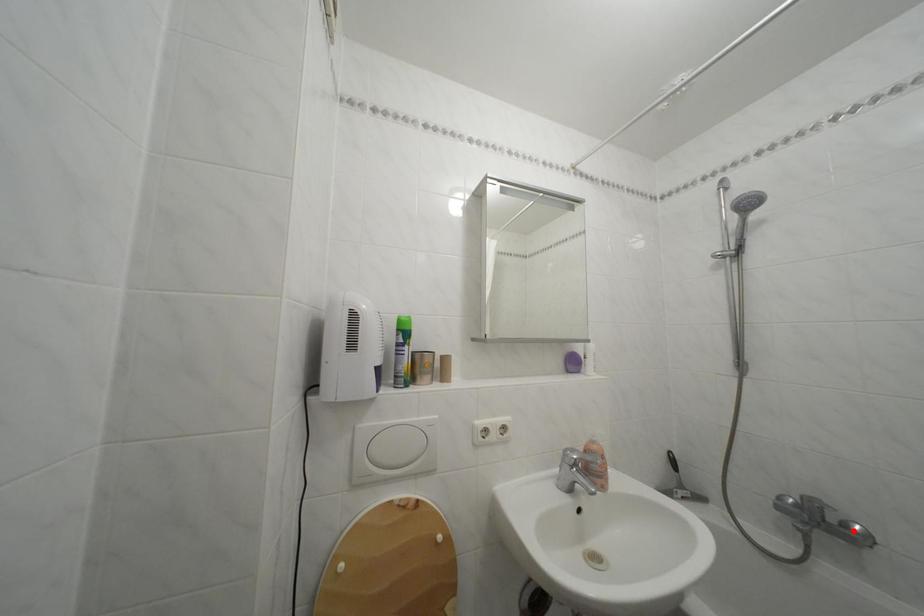
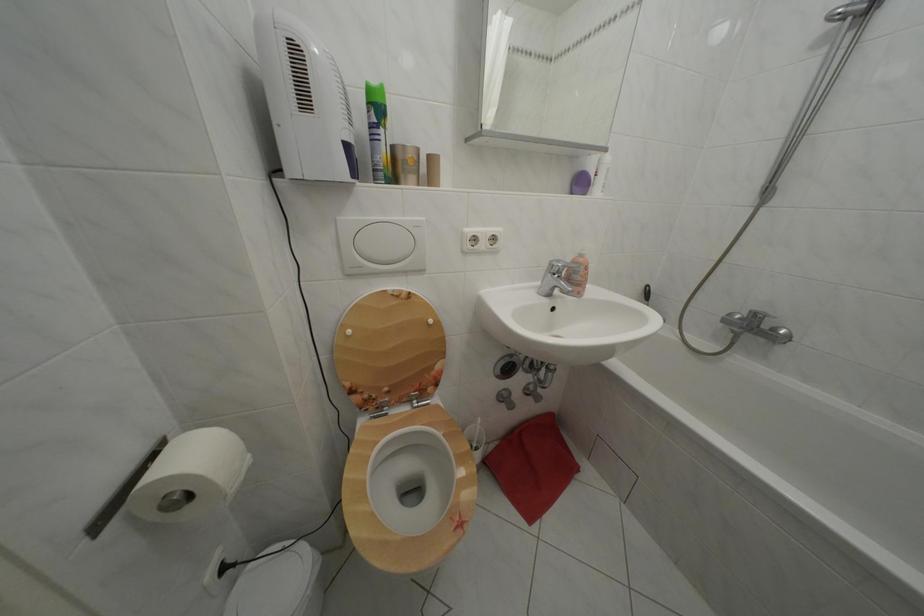
Question: I am providing you with two images of the same scene from different viewpoints. Given a red point in image1, look at the same physical point in image2. Is it:

Choices:
 (A) Closer to the viewpoint
 (B) Farther from the viewpoint

Answer: (B)